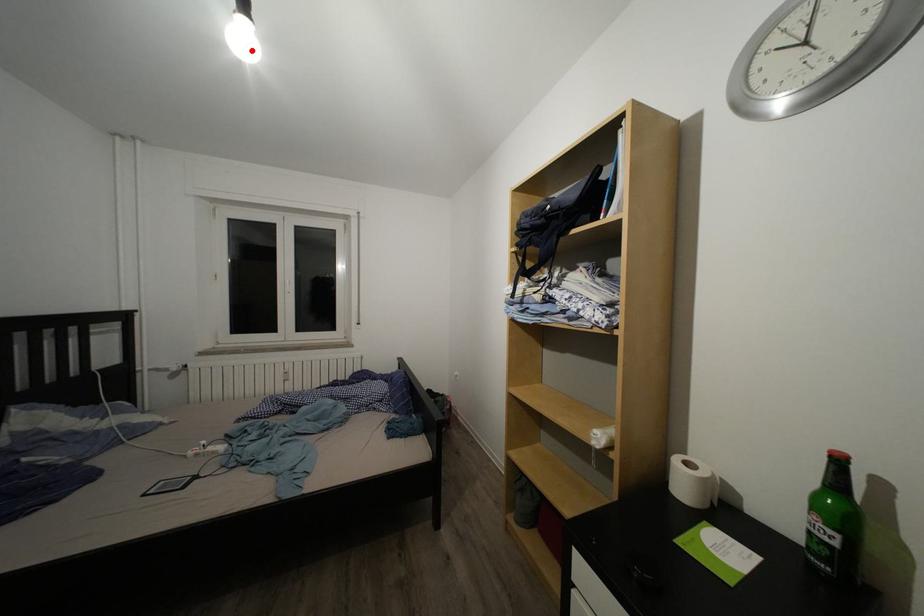
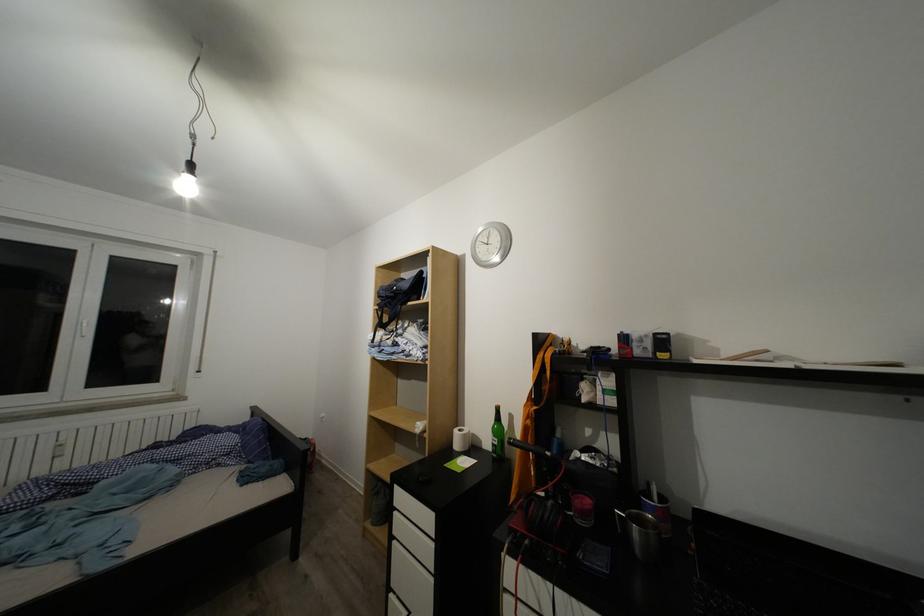
In the second image, find the point that corresponds to the highlighted location in the first image.

(193, 195)